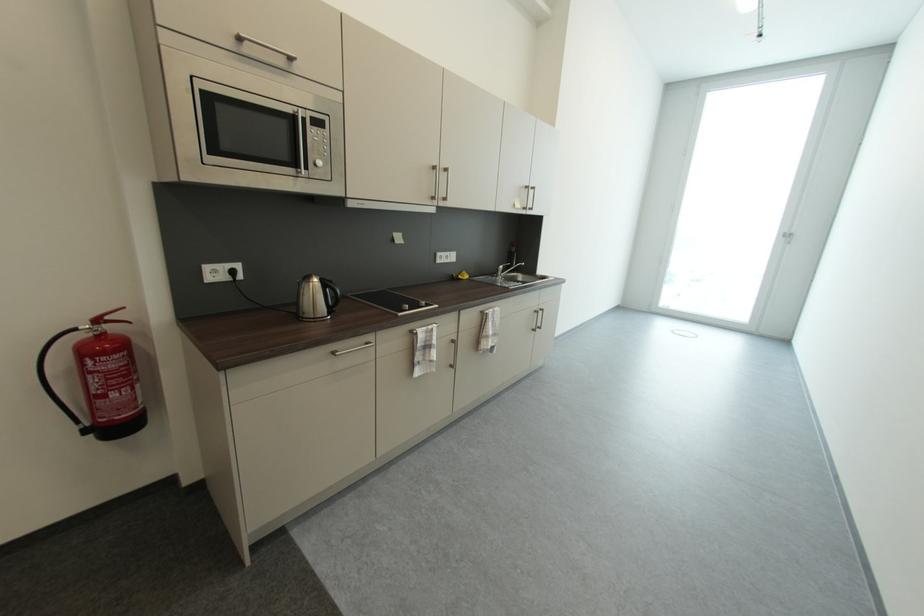
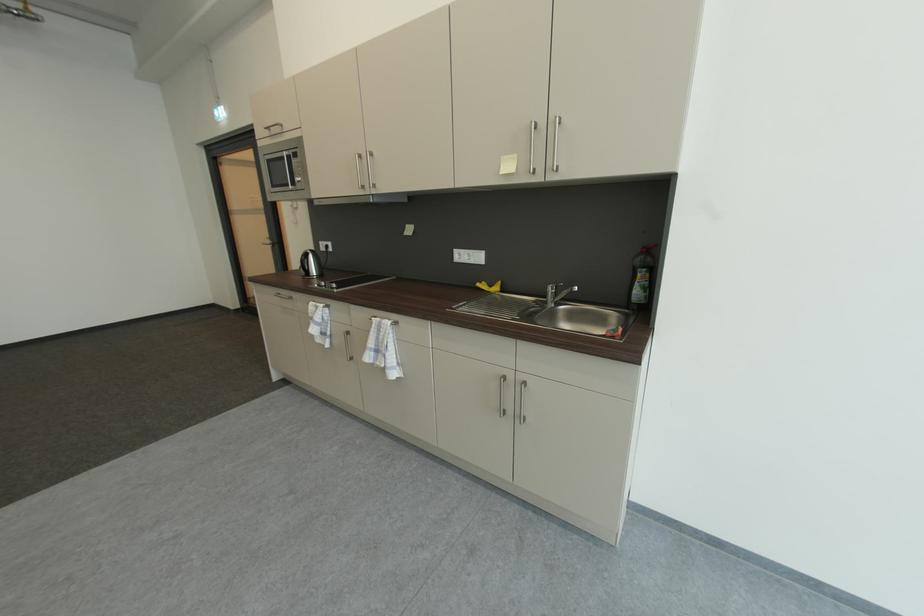
The point at (213, 269) is marked in the first image. Where is the corresponding point in the second image?

(327, 245)